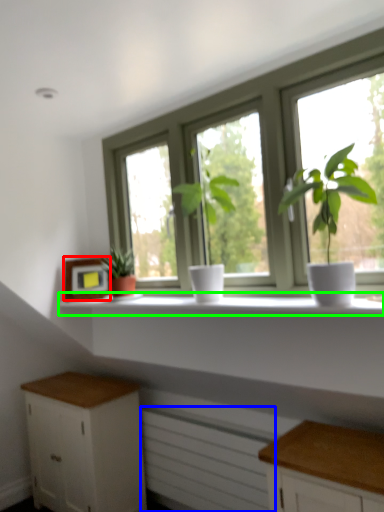
Question: Which object is positioned closest to picture frame (highlighted by a red box)? Select from radiator (highlighted by a blue box) and window sill (highlighted by a green box).

Choices:
 (A) radiator
 (B) window sill

Answer: (B)